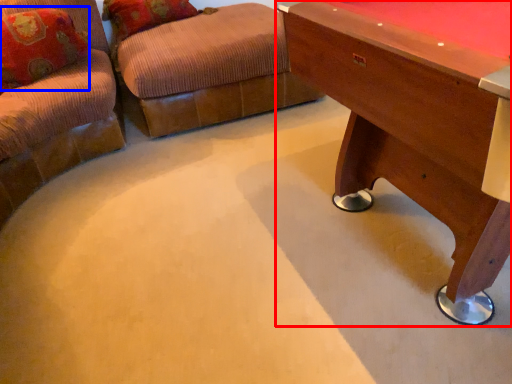
Question: Which point is further to the camera, table (highlighted by a red box) or pillow (highlighted by a blue box)?

Choices:
 (A) table
 (B) pillow

Answer: (B)